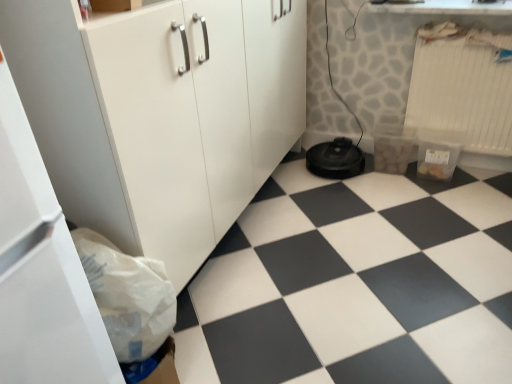
Locate an element on the screen. The height and width of the screenshot is (384, 512). free point above white plastic radiator at upper right (from a real-world perspective) is located at coordinates (475, 29).